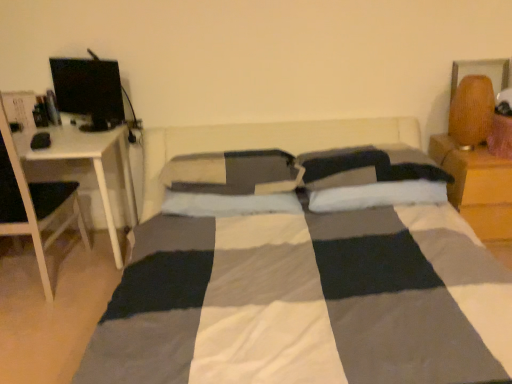
Question: Which direction should I rotate to face soft gray pillow at center, the third pillow positioned from the right, — up or down?

Choices:
 (A) up
 (B) down

Answer: (A)

Question: From the image's perspective, is white plastic computer desk at left located above matte black monitor at upper left?

Choices:
 (A) no
 (B) yes

Answer: (A)

Question: From the image's perspective, is white plastic computer desk at left below matte black monitor at upper left?

Choices:
 (A) yes
 (B) no

Answer: (A)

Question: Is white plastic computer desk at left further to the viewer compared to matte black monitor at upper left?

Choices:
 (A) yes
 (B) no

Answer: (B)

Question: Considering the relative positions of white plastic computer desk at left and matte black monitor at upper left in the image provided, is white plastic computer desk at left to the left of matte black monitor at upper left from the viewer's perspective?

Choices:
 (A) yes
 (B) no

Answer: (A)

Question: Considering the relative positions of white plastic computer desk at left and matte black monitor at upper left in the image provided, is white plastic computer desk at left to the right of matte black monitor at upper left from the viewer's perspective?

Choices:
 (A) no
 (B) yes

Answer: (A)

Question: From a real-world perspective, is white plastic computer desk at left on matte black monitor at upper left?

Choices:
 (A) no
 (B) yes

Answer: (A)

Question: Can you confirm if white soft pillow at center, the second pillow in the right-to-left sequence, is wider than matte black monitor at upper left?

Choices:
 (A) no
 (B) yes

Answer: (B)

Question: Is matte black monitor at upper left at the back of white soft pillow at center, the second pillow in the right-to-left sequence?

Choices:
 (A) yes
 (B) no

Answer: (B)

Question: Does white soft pillow at center, which is counted as the 2th pillow, starting from the left, have a lesser width compared to matte black monitor at upper left?

Choices:
 (A) yes
 (B) no

Answer: (B)

Question: Is white soft pillow at center, the second pillow in the right-to-left sequence, far from matte black monitor at upper left?

Choices:
 (A) no
 (B) yes

Answer: (A)

Question: From the image's perspective, is white soft pillow at center, which is counted as the 2th pillow, starting from the left, under matte black monitor at upper left?

Choices:
 (A) yes
 (B) no

Answer: (A)

Question: Considering the relative sizes of white soft pillow at center, the second pillow in the right-to-left sequence, and matte black monitor at upper left in the image provided, is white soft pillow at center, the second pillow in the right-to-left sequence, bigger than matte black monitor at upper left?

Choices:
 (A) yes
 (B) no

Answer: (A)

Question: Is the position of wooden nightstand at right more distant than that of matte black monitor at upper left?

Choices:
 (A) no
 (B) yes

Answer: (B)